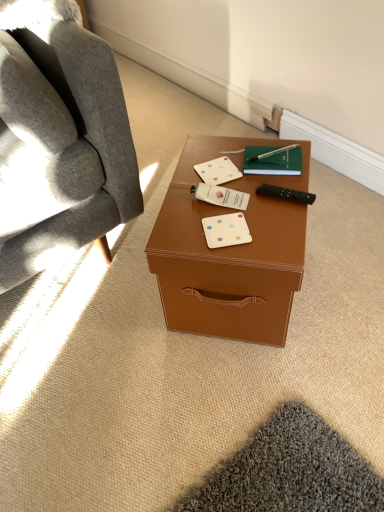
The width and height of the screenshot is (384, 512). What are the coordinates of `vacant space situated on the left part of white matte business card at center, marked as the third business card in a bottom-to-top arrangement` in the screenshot? It's located at (182, 181).